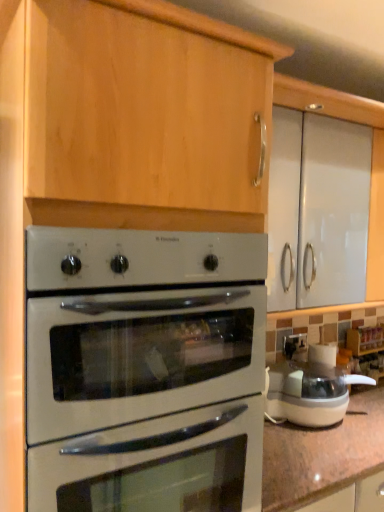
Question: Does white plastic food processor at right have a greater width compared to white glossy oven at center?

Choices:
 (A) no
 (B) yes

Answer: (A)

Question: Is white plastic food processor at right further to camera compared to white glossy oven at center?

Choices:
 (A) yes
 (B) no

Answer: (A)

Question: From the image's perspective, is white plastic food processor at right above white glossy oven at center?

Choices:
 (A) no
 (B) yes

Answer: (A)

Question: Is white plastic food processor at right facing towards white glossy oven at center?

Choices:
 (A) no
 (B) yes

Answer: (A)

Question: Considering the relative sizes of white plastic food processor at right and white glossy oven at center in the image provided, is white plastic food processor at right bigger than white glossy oven at center?

Choices:
 (A) no
 (B) yes

Answer: (A)

Question: From a real-world perspective, is white plastic food processor at right positioned under white glossy oven at center based on gravity?

Choices:
 (A) yes
 (B) no

Answer: (A)

Question: From the image's perspective, would you say white glossy oven at center is positioned over white plastic food processor at right?

Choices:
 (A) yes
 (B) no

Answer: (A)

Question: From the image's perspective, is white glossy oven at center beneath white plastic food processor at right?

Choices:
 (A) yes
 (B) no

Answer: (B)

Question: Does white glossy oven at center have a smaller size compared to white plastic food processor at right?

Choices:
 (A) no
 (B) yes

Answer: (A)

Question: Can you confirm if white glossy oven at center is shorter than white plastic food processor at right?

Choices:
 (A) no
 (B) yes

Answer: (A)

Question: Considering the relative sizes of white glossy oven at center and white plastic food processor at right in the image provided, is white glossy oven at center thinner than white plastic food processor at right?

Choices:
 (A) no
 (B) yes

Answer: (A)

Question: From a real-world perspective, is white glossy oven at center positioned over white plastic food processor at right based on gravity?

Choices:
 (A) yes
 (B) no

Answer: (A)

Question: Is point (198, 414) closer or farther from the camera than point (317, 423)?

Choices:
 (A) farther
 (B) closer

Answer: (B)